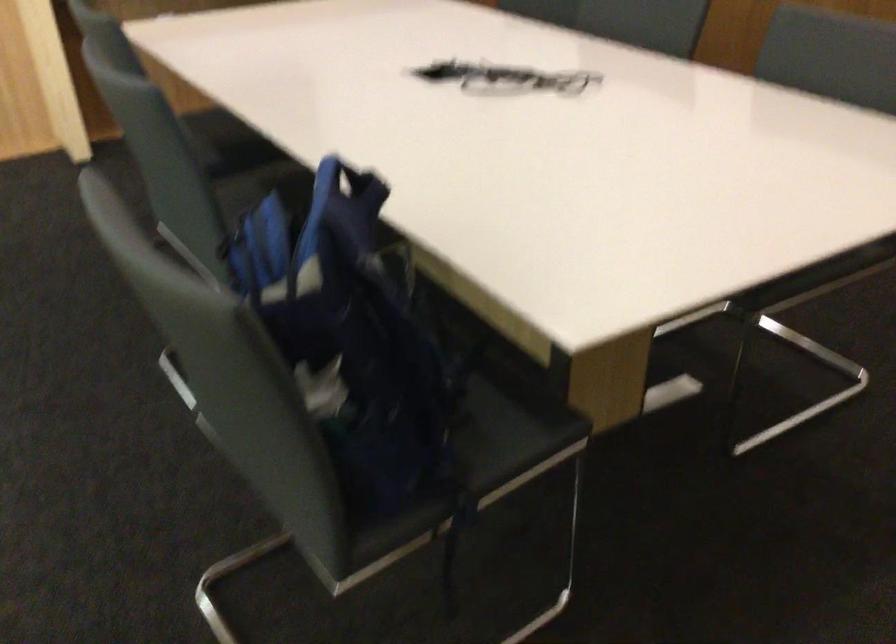
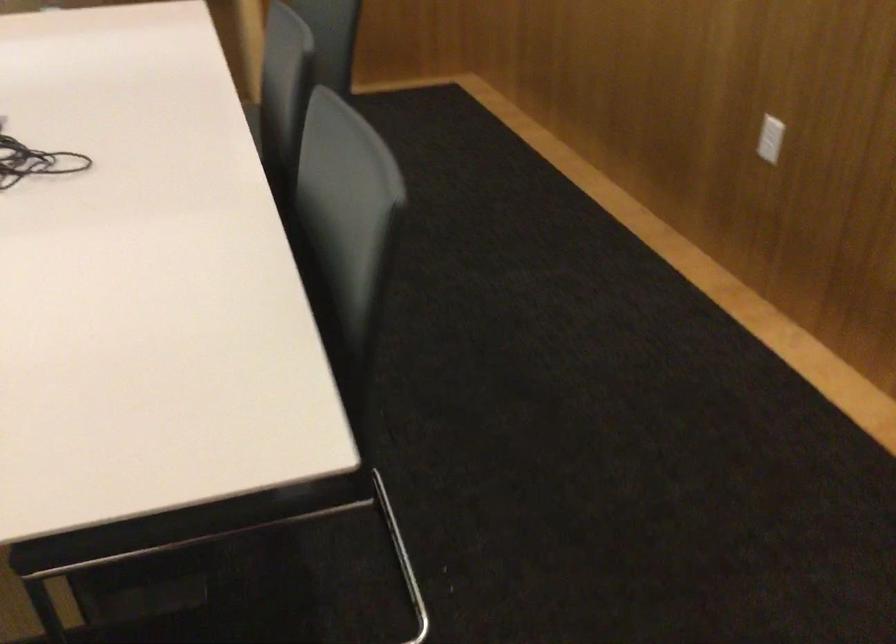
Which direction would the cameraman need to move to produce the second image?

The cameraman walked toward right, forward.